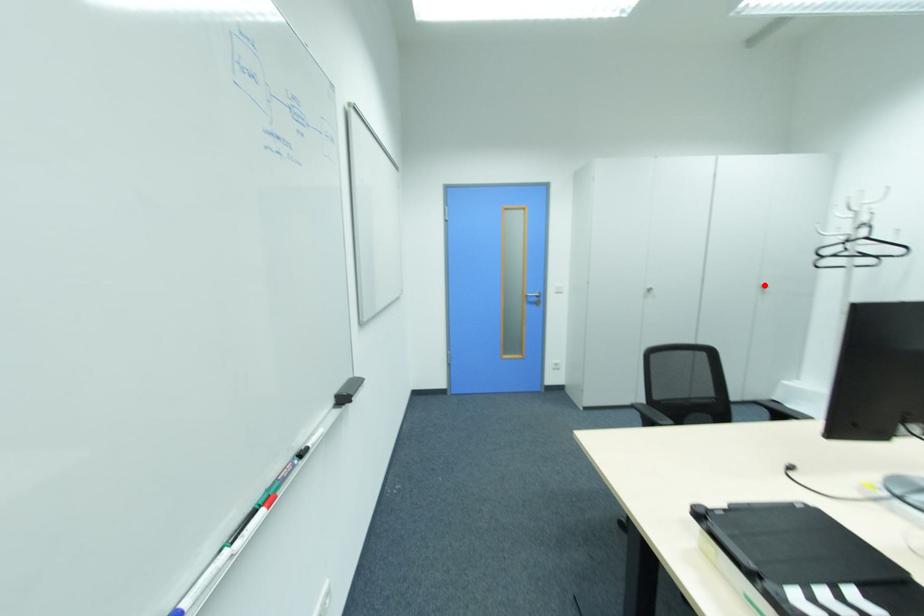
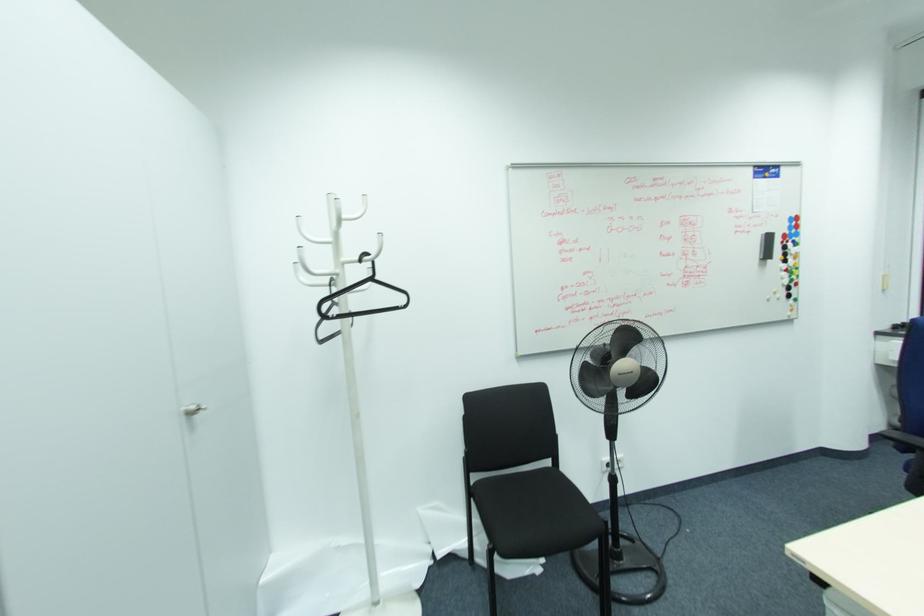
The point at the highlighted location is marked in the first image. Where is the corresponding point in the second image?

(191, 408)